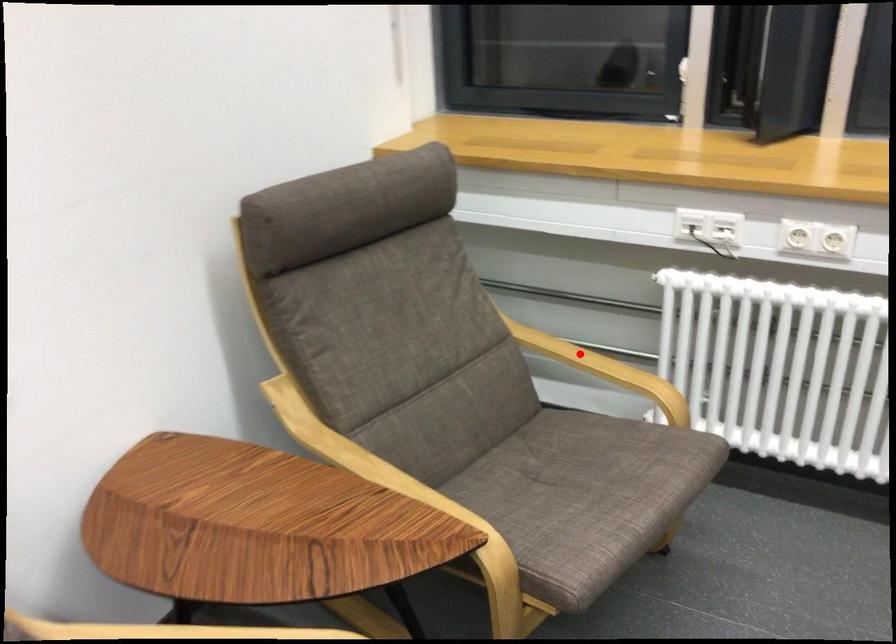
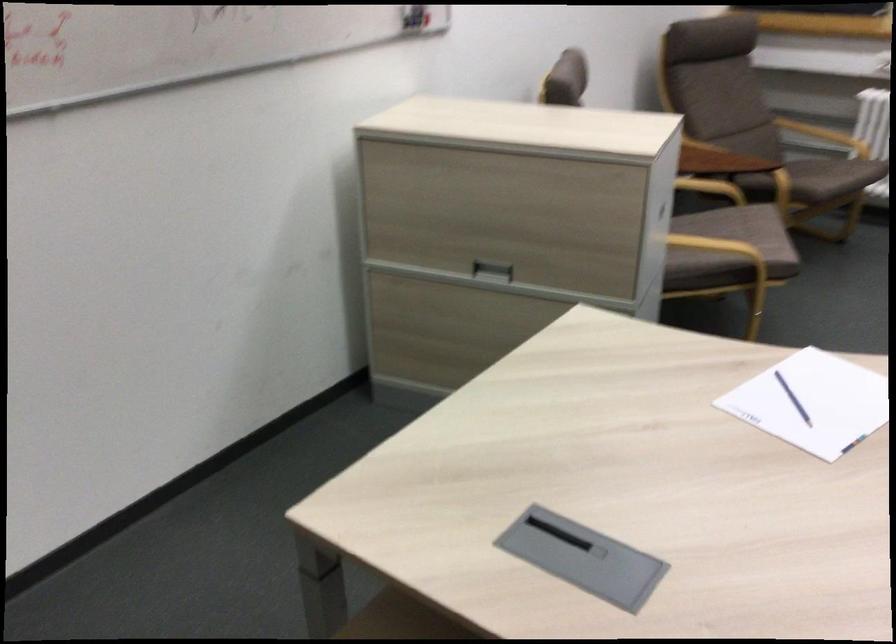
Question: I am providing you with two images of the same scene from different viewpoints. Image1 has a red point marked. In image2, the corresponding 3D location appears at what relative position? Reply with the corresponding letter.

Choices:
 (A) Closer
 (B) Farther

Answer: (B)